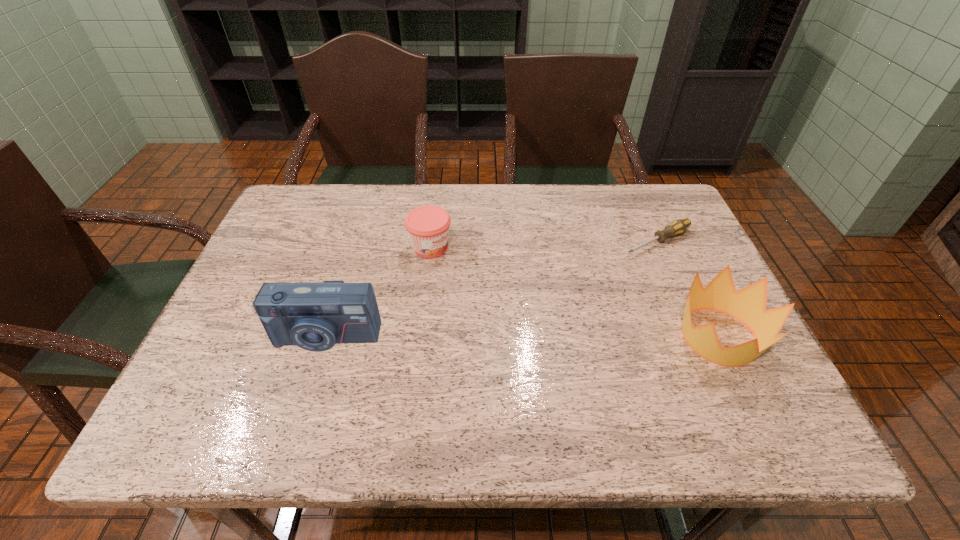
Where is `free space on the desktop that is between the camera and the crown and is positioned on the front label of the third tallest object`? The height and width of the screenshot is (540, 960). free space on the desktop that is between the camera and the crown and is positioned on the front label of the third tallest object is located at coordinates (570, 337).

The height and width of the screenshot is (540, 960). I want to click on free space on the desktop that is between the leftmost object and the crown and is positioned at the tip of the shortest object, so click(x=470, y=337).